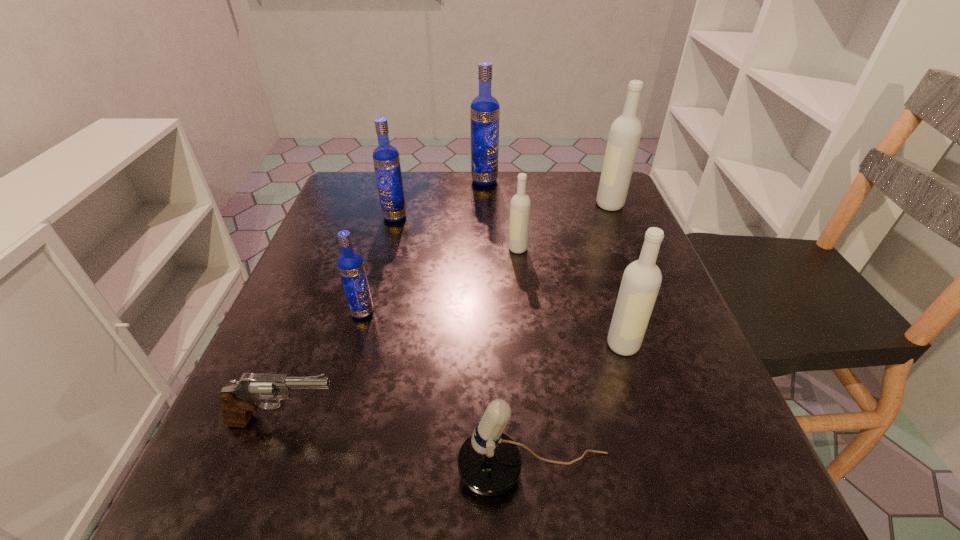
The height and width of the screenshot is (540, 960). Identify the location of the fourth farthest vodka. (520, 205).

At what (x,y) coordinates should I click in order to perform the action: click on the nearest object. Please return your answer as a coordinate pair (x, y). Looking at the image, I should click on (489, 462).

This screenshot has width=960, height=540. Identify the location of microphone. (489, 462).

Identify the location of the shortest object. (239, 401).

At what (x,y) coordinates should I click in order to perform the action: click on the second nearest object. Please return your answer as a coordinate pair (x, y). This screenshot has width=960, height=540. Looking at the image, I should click on (239, 401).

Where is `vacant space located 0.180m on the left of the fourth vodka from right to left`? The image size is (960, 540). vacant space located 0.180m on the left of the fourth vodka from right to left is located at coordinates (405, 180).

This screenshot has width=960, height=540. What are the coordinates of `free location located 0.080m on the front of the rightmost object` in the screenshot? It's located at pyautogui.click(x=621, y=232).

This screenshot has height=540, width=960. What are the coordinates of `vacant space situated 0.270m on the right of the second biggest blue vodka` in the screenshot? It's located at (518, 217).

Find the location of a particular element. This screenshot has height=540, width=960. blank space located on the back of the third nearest object is located at coordinates (593, 253).

You are a GUI agent. You are given a task and a screenshot of the screen. Output one action in this format:
    pyautogui.click(x=<x>, y=<y>)
    Task: Click on the free space located on the back of the smallest blue vodka
    This screenshot has height=540, width=960.
    Given the screenshot: What is the action you would take?
    pyautogui.click(x=393, y=204)